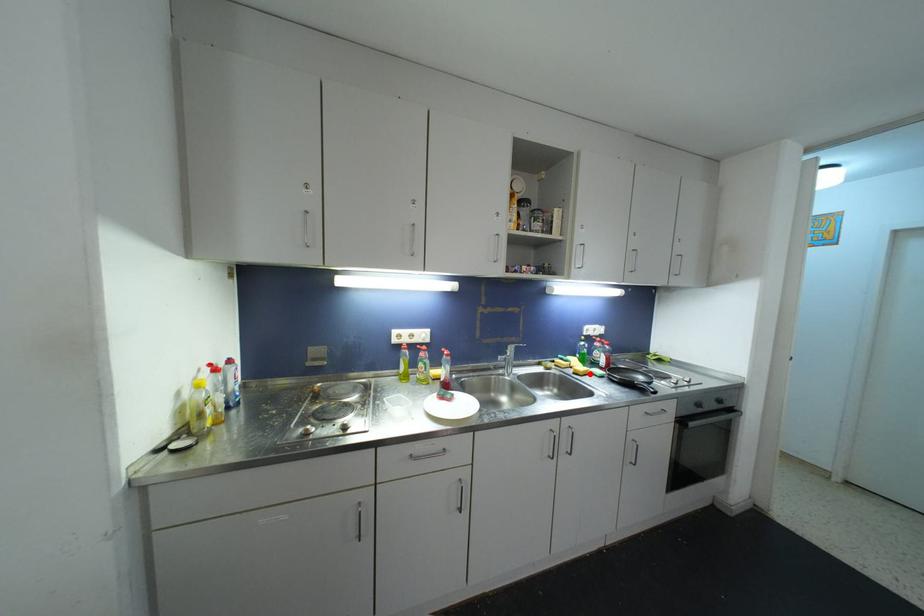
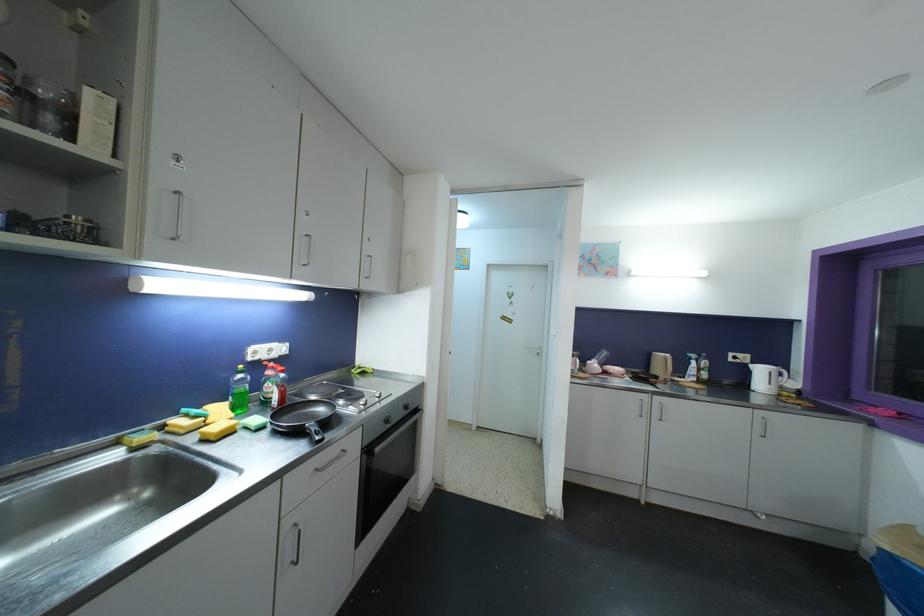
The point at the highlighted location is marked in the first image. Where is the corresponding point in the second image?

(236, 430)